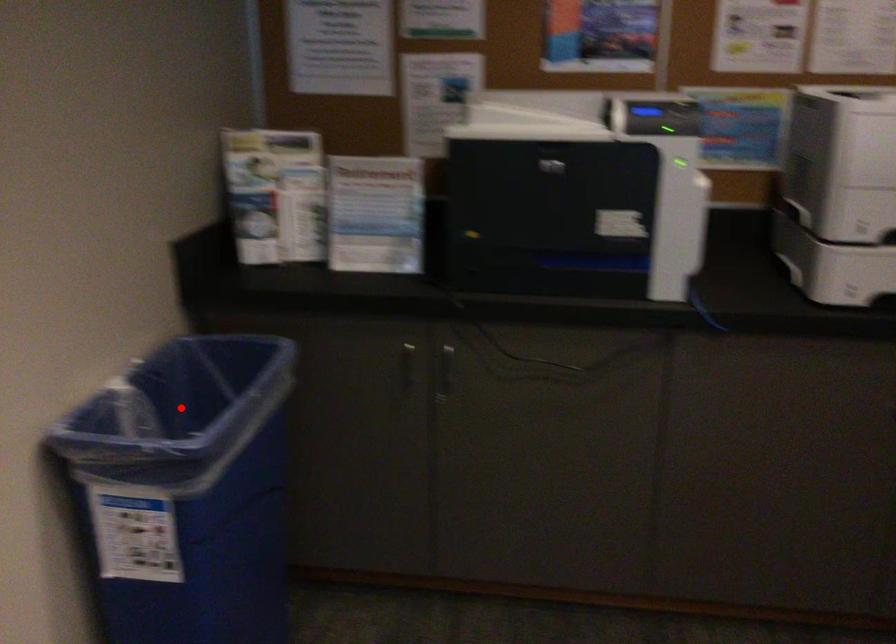
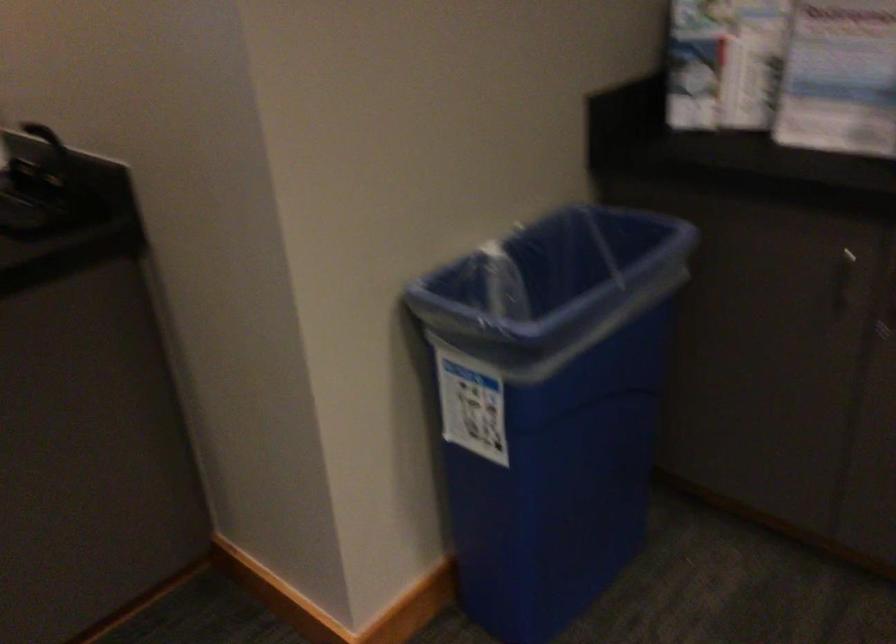
In the second image, find the point that corresponds to the highlighted location in the first image.

(556, 281)